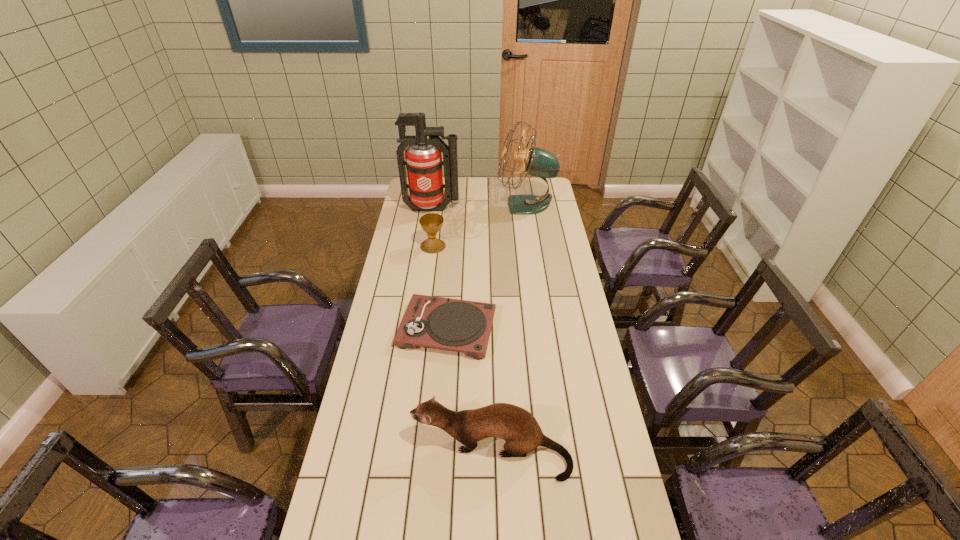
The width and height of the screenshot is (960, 540). I want to click on phonograph_record located in the left edge section of the desktop, so pos(456,325).

I want to click on fan that is positioned at the right edge, so click(538, 162).

The height and width of the screenshot is (540, 960). In order to click on ferret that is positioned at the right edge in this screenshot , I will do `click(518, 427)`.

Where is `object that is positioned at the far right corner`? object that is positioned at the far right corner is located at coordinates (538, 162).

In the image, there is a desktop. Where is `vacant space at the far edge`? This screenshot has height=540, width=960. vacant space at the far edge is located at coordinates (516, 180).

In the image, there is a desktop. What are the coordinates of `vacant region at the left edge` in the screenshot? It's located at (415, 217).

This screenshot has height=540, width=960. In the image, there is a desktop. Identify the location of vacant space at the right edge. (576, 286).

Identify the location of empty location between the third nearest object and the fan. The height and width of the screenshot is (540, 960). (480, 226).

Locate an element on the screen. The width and height of the screenshot is (960, 540). free space between the fan and the fire extinguisher is located at coordinates (479, 207).

The image size is (960, 540). Find the location of `empty space between the fan and the third tallest object`. empty space between the fan and the third tallest object is located at coordinates (509, 328).